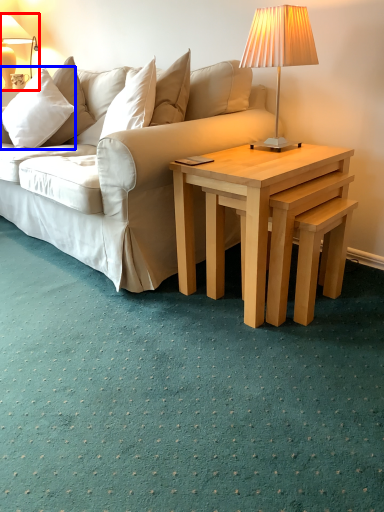
Question: Which point is closer to the camera, lamp (highlighted by a red box) or pillow (highlighted by a blue box)?

Choices:
 (A) lamp
 (B) pillow

Answer: (B)